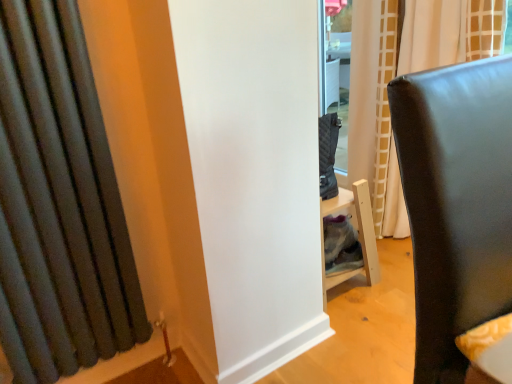
Question: In the image, is dark gray fabric curtain at left, marked as the 2th curtain in a right-to-left arrangement, on the left side or the right side of matte black chair at right?

Choices:
 (A) left
 (B) right

Answer: (A)

Question: Considering the positions of dark gray fabric curtain at left, which is the 1th curtain from front to back, and matte black chair at right in the image, is dark gray fabric curtain at left, which is the 1th curtain from front to back, taller or shorter than matte black chair at right?

Choices:
 (A) tall
 (B) short

Answer: (A)

Question: Which is farther from the matte white curtain at center, which appears as the first curtain when viewed from the right?

Choices:
 (A) matte black chair at right
 (B) dark gray fabric curtain at left, acting as the 2th curtain starting from the back

Answer: (B)

Question: Which object is the farthest from the matte black chair at right?

Choices:
 (A) dark gray fabric curtain at left, which is the 1th curtain from front to back
 (B) matte white curtain at center, which appears as the first curtain when viewed from the right

Answer: (B)